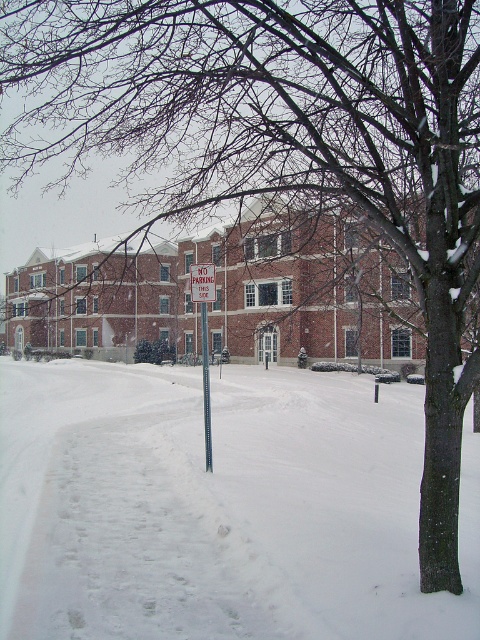
Between metallic pole at center and red plastic sign at center, which one appears on the right side from the viewer's perspective?

red plastic sign at center is more to the right.

Can you confirm if metallic pole at center is positioned below red plastic sign at center?

Yes, metallic pole at center is below red plastic sign at center.

What are the coordinates of `metallic pole at center` in the screenshot? It's located at coord(205,387).

Does metallic rectangular sign at center have a lesser height compared to red plastic sign at center?

Incorrect, metallic rectangular sign at center's height does not fall short of red plastic sign at center's.

Describe the element at coordinates (204, 339) in the screenshot. I see `metallic rectangular sign at center` at that location.

Find the location of a particular element. Image resolution: width=480 pixels, height=640 pixels. metallic rectangular sign at center is located at coordinates (204, 339).

Describe the element at coordinates (218, 506) in the screenshot. I see `white powdery snow at center` at that location.

From the picture: Does white powdery snow at center appear under metallic rectangular sign at center?

Yes, white powdery snow at center is below metallic rectangular sign at center.

Does point (225, 634) come farther from viewer compared to point (204, 368)?

No, it is in front of (204, 368).

Locate an element on the screen. The width and height of the screenshot is (480, 640). white powdery snow at center is located at coordinates (218, 506).